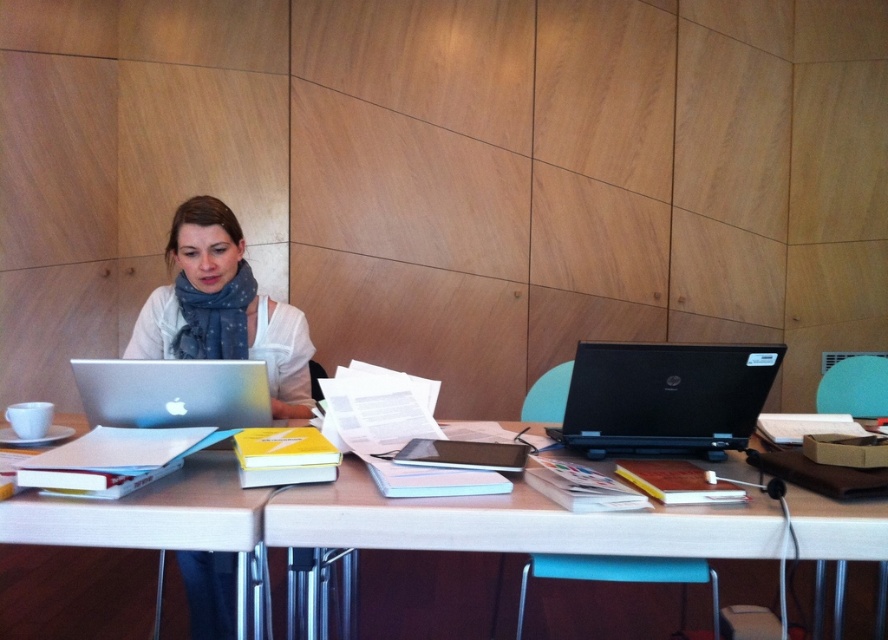
You are organizing a meeting in the workspace shown. You need to place a 1.2 meter wide whiteboard between the white glossy table at lower left and the black matte laptop at right. Is there enough space between them for the whiteboard?

The white glossy table at lower left might be wider than the black matte laptop at right, but the exact distance isn not specified. Without knowing the actual spacing between them, it is uncertain if the 1.2 meter whiteboard would fit.

You are standing in front of the workspace and want to place a small object on the closest item. Which item should you choose between the white matte table at center and the matte white scarf at upper left?

The white matte table at center is closer to the viewer than the matte white scarf at upper left, so you should place the small object on the white matte table at center.